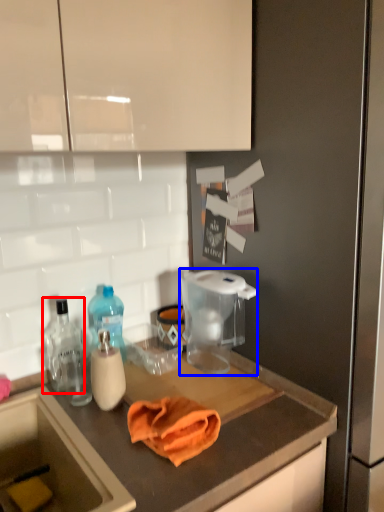
Question: Which point is further to the camera, bottle (highlighted by a red box) or appliance (highlighted by a blue box)?

Choices:
 (A) bottle
 (B) appliance

Answer: (A)